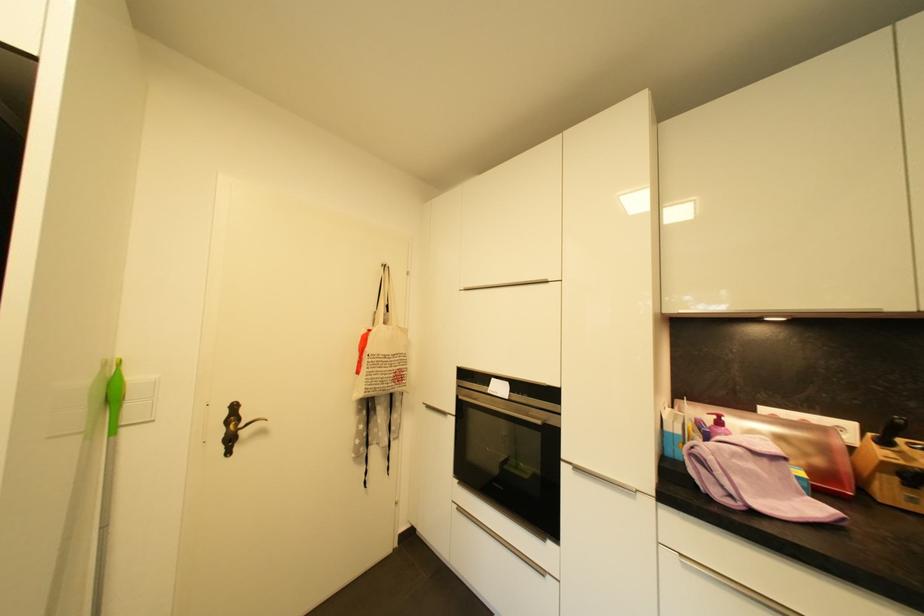
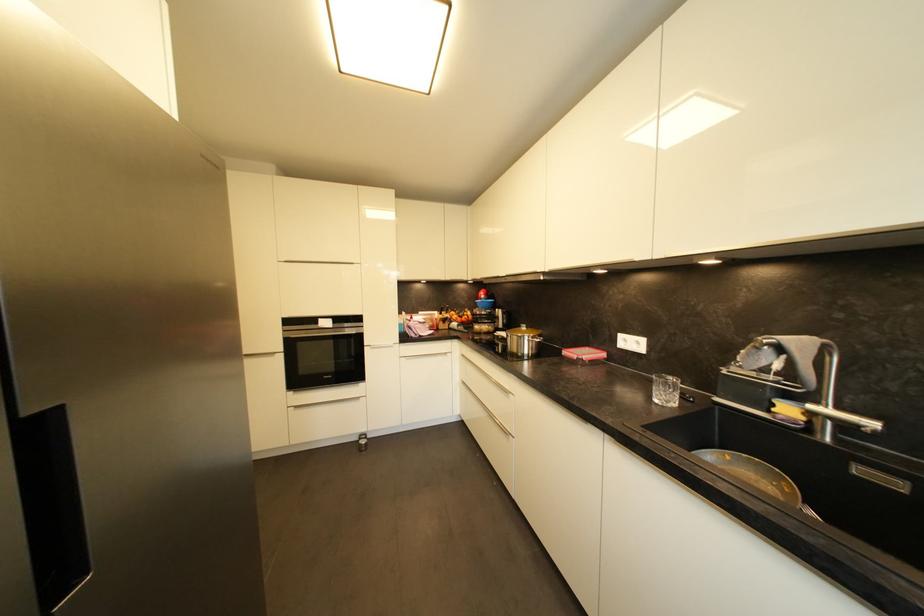
In the second image, find the point that corresponds to (464,387) in the first image.

(289, 333)